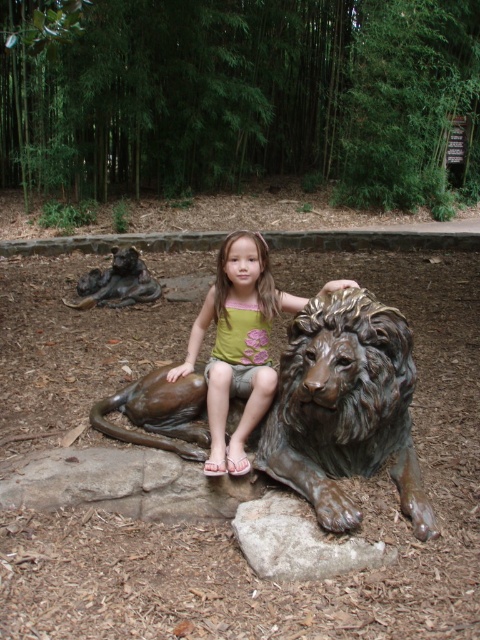
Question: Which point appears farthest from the camera in this image?

Choices:
 (A) (153, 292)
 (B) (264, 388)

Answer: (A)

Question: Observing the image, what is the correct spatial positioning of gray stone at lower center in reference to bronze statue at upper left?

Choices:
 (A) left
 (B) right

Answer: (B)

Question: Which object is farther from the camera taking this photo?

Choices:
 (A) matte bronze lion at center
 (B) bronze lion at center
 (C) bronze statue at upper left
 (D) gray stone at lower center

Answer: (C)

Question: Which of the following is the farthest from the observer?

Choices:
 (A) bronze lion at center
 (B) matte bronze lion at center
 (C) bronze statue at upper left

Answer: (C)

Question: From the image, what is the correct spatial relationship of matte bronze lion at center in relation to gray stone at lower center?

Choices:
 (A) below
 (B) above

Answer: (B)

Question: Is bronze lion at center to the right of bronze statue at upper left from the viewer's perspective?

Choices:
 (A) yes
 (B) no

Answer: (A)